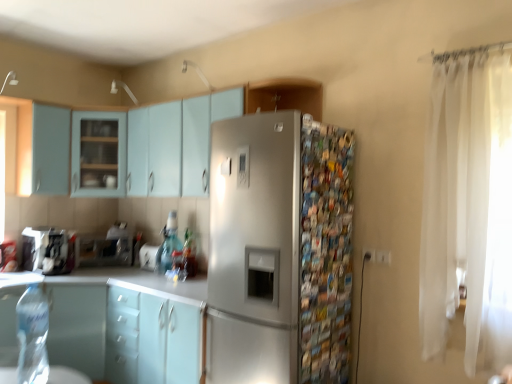
This screenshot has height=384, width=512. Identify the location of free space in front of clear glass jar at center, the first appliance in the right-to-left sequence. (146, 271).